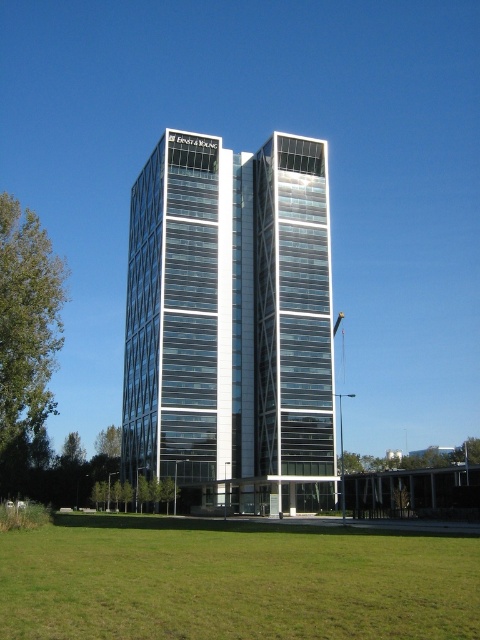
You are standing in front of the Ernst and Young building. You see the transparent glass building at center and the green grass at lower center. Which object is positioned to the left?

The transparent glass building at center is to the left of green grass at lower center.

You are a drone operator tasked with capturing aerial footage of the transparent glass building at center and the green grass at lower center. Your drone has a maximum flight range of 40 meters. Can you reach both locations without exceeding the drone range limit?

The distance between the transparent glass building at center and green grass at lower center is 41.63 meters, which exceeds the drone range of 40 meters. Therefore, the drone cannot reach both locations without exceeding the range limit.